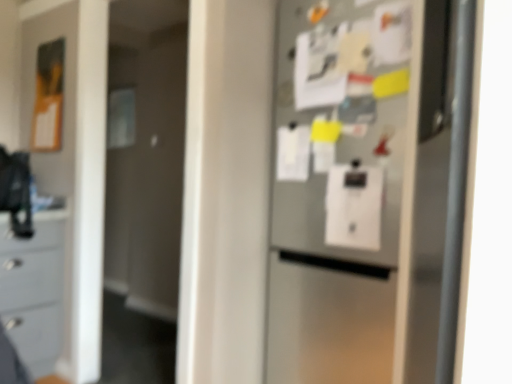
Identify the location of satin silver refrigerator at center. (367, 190).

This screenshot has width=512, height=384. What do you see at coordinates (367, 190) in the screenshot?
I see `satin silver refrigerator at center` at bounding box center [367, 190].

At what (x,y) coordinates should I click in order to perform the action: click on satin silver refrigerator at center. Please return your answer as a coordinate pair (x, y). Looking at the image, I should click on (367, 190).